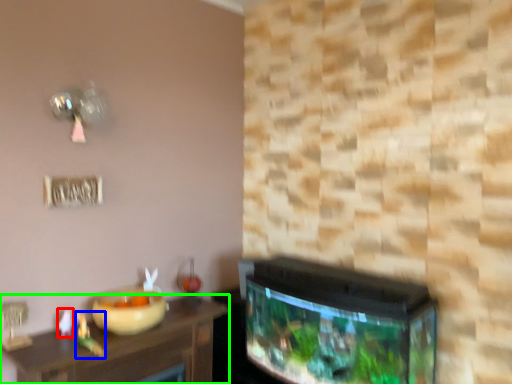
Question: Considering the real-world distances, which object is farthest from toy (highlighted by a red box)? toy (highlighted by a blue box) or table (highlighted by a green box)?

Choices:
 (A) toy
 (B) table

Answer: (B)